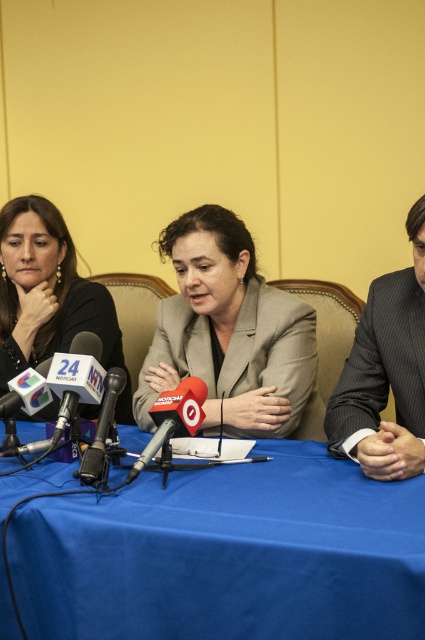
Describe the element at coordinates (48, 296) in the screenshot. Image resolution: width=425 pixels, height=640 pixels. I see `matte black jacket at left` at that location.

In the scene shown: Who is higher up, matte black jacket at left or red matte microphone at center?

matte black jacket at left is higher up.

Where is `matte black jacket at left`? The image size is (425, 640). matte black jacket at left is located at coordinates click(x=48, y=296).

Does gray pinstripe suit at right appear under black matte microphone at center?

No, gray pinstripe suit at right is not below black matte microphone at center.

Who is taller, gray pinstripe suit at right or black matte microphone at center?

With more height is gray pinstripe suit at right.

Between point (413, 449) and point (110, 387), which one is positioned in front?

Positioned in front is point (413, 449).

Identify the location of gray pinstripe suit at right. (385, 372).

Does blue fabric table at center appear on the left side of red matte microphone at center?

Incorrect, blue fabric table at center is not on the left side of red matte microphone at center.

Can you confirm if blue fabric table at center is wider than red matte microphone at center?

Indeed, blue fabric table at center has a greater width compared to red matte microphone at center.

Does point (241, 570) come farther from viewer compared to point (156, 436)?

No.

Identify the location of blue fabric table at center. (226, 554).